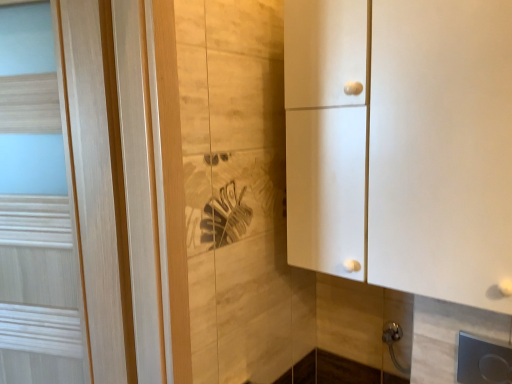
Question: Considering the relative sizes of metallic silver door handle at lower right and white matte cabinet at right in the image provided, is metallic silver door handle at lower right smaller than white matte cabinet at right?

Choices:
 (A) no
 (B) yes

Answer: (B)

Question: Could you tell me if metallic silver door handle at lower right is turned towards white matte cabinet at right?

Choices:
 (A) no
 (B) yes

Answer: (A)

Question: Considering the relative positions of metallic silver door handle at lower right and white matte cabinet at right in the image provided, is metallic silver door handle at lower right to the left of white matte cabinet at right from the viewer's perspective?

Choices:
 (A) no
 (B) yes

Answer: (A)

Question: Is metallic silver door handle at lower right positioned in front of white matte cabinet at right?

Choices:
 (A) no
 (B) yes

Answer: (A)

Question: Is metallic silver door handle at lower right wider than white matte cabinet at right?

Choices:
 (A) no
 (B) yes

Answer: (A)

Question: Does metallic silver door handle at lower right appear on the right side of white matte cabinet at right?

Choices:
 (A) yes
 (B) no

Answer: (A)

Question: From a real-world perspective, is light wood door at left physically above metallic silver door handle at lower right?

Choices:
 (A) no
 (B) yes

Answer: (B)

Question: Is light wood door at left smaller than metallic silver door handle at lower right?

Choices:
 (A) no
 (B) yes

Answer: (A)

Question: Can you confirm if light wood door at left is positioned to the left of metallic silver door handle at lower right?

Choices:
 (A) no
 (B) yes

Answer: (B)

Question: From the image's perspective, is light wood door at left beneath metallic silver door handle at lower right?

Choices:
 (A) no
 (B) yes

Answer: (A)

Question: From a real-world perspective, is light wood door at left located beneath metallic silver door handle at lower right?

Choices:
 (A) no
 (B) yes

Answer: (A)

Question: Could you tell me if light wood door at left is facing metallic silver door handle at lower right?

Choices:
 (A) no
 (B) yes

Answer: (A)

Question: Does light wood door at left have a smaller size compared to white matte cabinet at right?

Choices:
 (A) no
 (B) yes

Answer: (B)